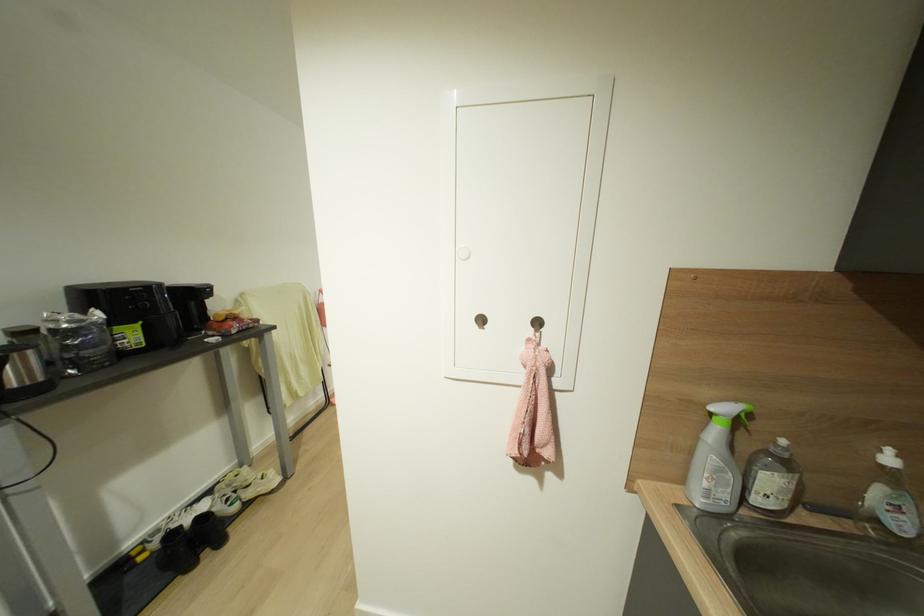
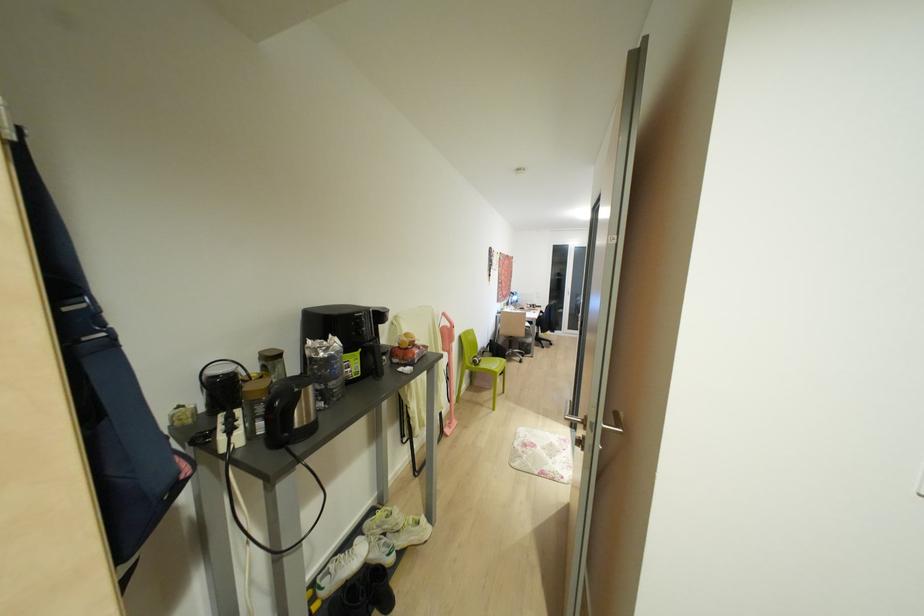
Question: What movement of the cameraman would produce the second image?

Choices:
 (A) Left
 (B) Right
 (C) Forward
 (D) Backward

Answer: (A)